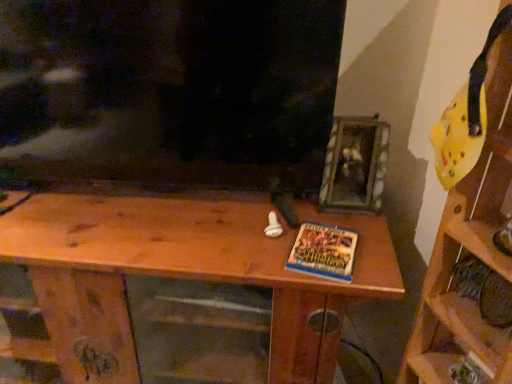
This screenshot has height=384, width=512. Describe the element at coordinates (323, 252) in the screenshot. I see `blue glossy book at center` at that location.

Identify the location of blue glossy book at center. (323, 252).

Identify the location of yellow foam helmet at upper right, which is the first shelf from right to left. (471, 232).

Looking at this image, measure the distance between yellow foam helmet at upper right, which is the first shelf from right to left, and camera.

yellow foam helmet at upper right, which is the first shelf from right to left, and camera are 64.58 centimeters apart.

Locate an element on the screen. blue glossy book at center is located at coordinates (323, 252).

Between yellow foam helmet at upper right, placed as the second shelf when sorted from left to right, and wooden table at center, the 2th shelf positioned from the right, which one has larger size?

→ wooden table at center, the 2th shelf positioned from the right.

From the image's perspective, is yellow foam helmet at upper right, which is the first shelf from right to left, under wooden table at center, which is counted as the first shelf, starting from the left?

No, from the image's perspective, yellow foam helmet at upper right, which is the first shelf from right to left, is not below wooden table at center, which is counted as the first shelf, starting from the left.

From a real-world perspective, is yellow foam helmet at upper right, which is the first shelf from right to left, under wooden table at center, the 2th shelf positioned from the right?

No, from a real-world perspective, yellow foam helmet at upper right, which is the first shelf from right to left, is not under wooden table at center, the 2th shelf positioned from the right.

Considering their positions, is yellow foam helmet at upper right, placed as the second shelf when sorted from left to right, located in front of or behind wooden table at center, the 2th shelf positioned from the right?

yellow foam helmet at upper right, placed as the second shelf when sorted from left to right, is in front of wooden table at center, the 2th shelf positioned from the right.

Considering the positions of objects yellow foam helmet at upper right, which is the first shelf from right to left, and blue glossy book at center in the image provided, who is more to the left, yellow foam helmet at upper right, which is the first shelf from right to left, or blue glossy book at center?

blue glossy book at center is more to the left.

Does yellow foam helmet at upper right, placed as the second shelf when sorted from left to right, touch blue glossy book at center?

No, yellow foam helmet at upper right, placed as the second shelf when sorted from left to right, is not next to blue glossy book at center.

From the picture: Which is further, (228, 261) or (287, 259)?

Point (287, 259)

Are wooden table at center, the 2th shelf positioned from the right, and blue glossy book at center beside each other?

wooden table at center, the 2th shelf positioned from the right, is not next to blue glossy book at center, and they're not touching.

How far apart are wooden table at center, which is counted as the first shelf, starting from the left, and blue glossy book at center?

They are 11.18 inches apart.

Can you tell me how much wooden table at center, which is counted as the first shelf, starting from the left, and blue glossy book at center differ in facing direction?

The facing directions of wooden table at center, which is counted as the first shelf, starting from the left, and blue glossy book at center are 1.76 degrees apart.

Which object is positioned more to the right, blue glossy book at center or wooden table at center, which is counted as the first shelf, starting from the left?

blue glossy book at center.

Is point (300, 246) farther from viewer compared to point (325, 309)?

No, (300, 246) is closer to viewer.

Between blue glossy book at center and wooden table at center, the 2th shelf positioned from the right, which one has larger size?

Bigger between the two is wooden table at center, the 2th shelf positioned from the right.

In terms of width, does blue glossy book at center look wider or thinner when compared to wooden table at center, which is counted as the first shelf, starting from the left?

Considering their sizes, blue glossy book at center looks slimmer than wooden table at center, which is counted as the first shelf, starting from the left.

Which object is positioned more to the left, wooden table at center, the 2th shelf positioned from the right, or yellow foam helmet at upper right, placed as the second shelf when sorted from left to right?

From the viewer's perspective, wooden table at center, the 2th shelf positioned from the right, appears more on the left side.

Does point (382, 273) appear closer or farther from the camera than point (432, 306)?

Clearly, point (382, 273) is closer to the camera than point (432, 306).

Is wooden table at center, which is counted as the first shelf, starting from the left, shorter than yellow foam helmet at upper right, which is the first shelf from right to left?

Indeed, wooden table at center, which is counted as the first shelf, starting from the left, has a lesser height compared to yellow foam helmet at upper right, which is the first shelf from right to left.

Considering the positions of objects wooden table at center, the 2th shelf positioned from the right, and yellow foam helmet at upper right, which is the first shelf from right to left, in the image provided, who is in front, wooden table at center, the 2th shelf positioned from the right, or yellow foam helmet at upper right, which is the first shelf from right to left,?

yellow foam helmet at upper right, which is the first shelf from right to left, is more forward.

How much distance is there between blue glossy book at center and yellow foam helmet at upper right, placed as the second shelf when sorted from left to right?

The distance of blue glossy book at center from yellow foam helmet at upper right, placed as the second shelf when sorted from left to right, is 11.31 inches.

Is blue glossy book at center turned away from yellow foam helmet at upper right, which is the first shelf from right to left?

No, yellow foam helmet at upper right, which is the first shelf from right to left, is not at the back of blue glossy book at center.

From the image's perspective, which one is positioned lower, blue glossy book at center or yellow foam helmet at upper right, placed as the second shelf when sorted from left to right?

yellow foam helmet at upper right, placed as the second shelf when sorted from left to right, from the image's perspective.

From a real-world perspective, is blue glossy book at center beneath yellow foam helmet at upper right, which is the first shelf from right to left?

Actually, blue glossy book at center is physically above yellow foam helmet at upper right, which is the first shelf from right to left, in the real world.

Locate an element on the screen. This screenshot has width=512, height=384. shelf above the wooden table at center, which is counted as the first shelf, starting from the left (from a real-world perspective) is located at coordinates (471, 232).

At what (x,y) coordinates should I click in order to perform the action: click on book on the left of the yellow foam helmet at upper right, placed as the second shelf when sorted from left to right. Please return your answer as a coordinate pair (x, y). This screenshot has height=384, width=512. Looking at the image, I should click on (323, 252).

When comparing their distances from wooden table at center, the 2th shelf positioned from the right, does yellow foam helmet at upper right, which is the first shelf from right to left, or blue glossy book at center seem closer?

The object closer to wooden table at center, the 2th shelf positioned from the right, is blue glossy book at center.

Based on their spatial positions, is yellow foam helmet at upper right, which is the first shelf from right to left, or wooden table at center, which is counted as the first shelf, starting from the left, further from blue glossy book at center?

yellow foam helmet at upper right, which is the first shelf from right to left, lies further to blue glossy book at center than the other object.

Looking at the image, which one is located closer to blue glossy book at center, wooden table at center, the 2th shelf positioned from the right, or yellow foam helmet at upper right, placed as the second shelf when sorted from left to right?

Among the two, wooden table at center, the 2th shelf positioned from the right, is located nearer to blue glossy book at center.

From the image, which object appears to be farther from yellow foam helmet at upper right, placed as the second shelf when sorted from left to right, wooden table at center, the 2th shelf positioned from the right, or blue glossy book at center?

wooden table at center, the 2th shelf positioned from the right, is further to yellow foam helmet at upper right, placed as the second shelf when sorted from left to right.

Which object lies further to the anchor point wooden table at center, which is counted as the first shelf, starting from the left, blue glossy book at center or yellow foam helmet at upper right, placed as the second shelf when sorted from left to right?

yellow foam helmet at upper right, placed as the second shelf when sorted from left to right, is positioned further to the anchor wooden table at center, which is counted as the first shelf, starting from the left.

Considering their positions, is blue glossy book at center positioned further to yellow foam helmet at upper right, which is the first shelf from right to left, than wooden table at center, which is counted as the first shelf, starting from the left?

wooden table at center, which is counted as the first shelf, starting from the left.

Image resolution: width=512 pixels, height=384 pixels. In order to click on book between wooden table at center, which is counted as the first shelf, starting from the left, and yellow foam helmet at upper right, placed as the second shelf when sorted from left to right, from left to right in this screenshot , I will do `click(323, 252)`.